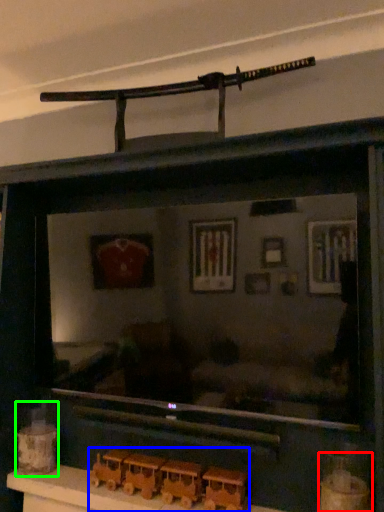
Question: Estimate the real-world distances between objects in this image. Which object is closer to toy (highlighted by a red box), toy (highlighted by a blue box) or toy (highlighted by a green box)?

Choices:
 (A) toy
 (B) toy

Answer: (A)